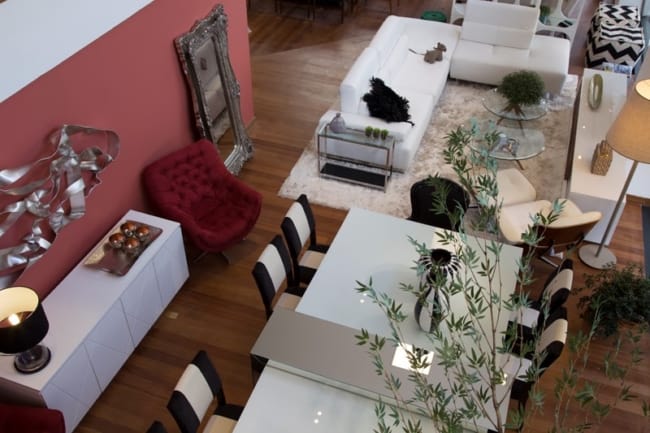
This screenshot has height=433, width=650. Identify the location of black lamp. (23, 329).